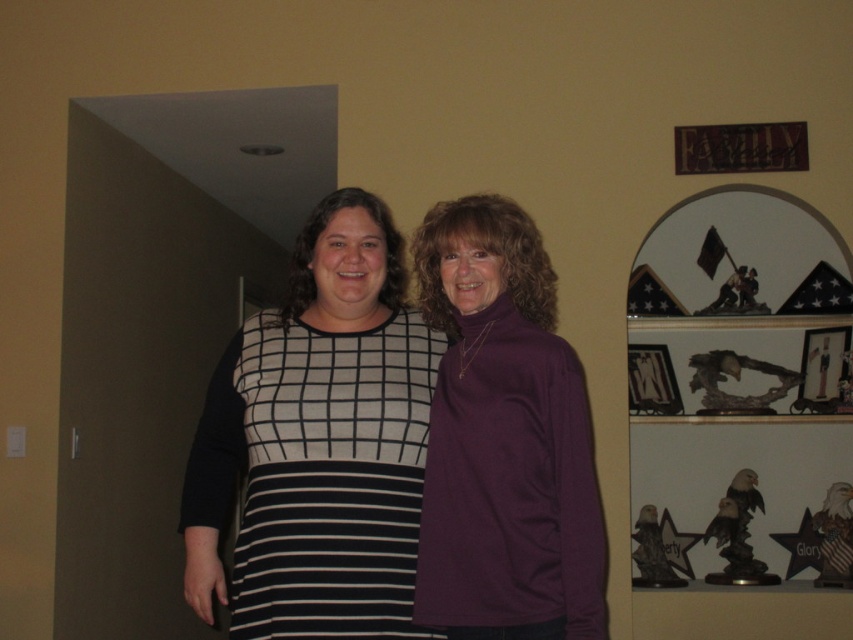
Does purple matte turtleneck sweater at right lie in front of black and white striped dress at center?

That is True.

Which is in front, point (576, 451) or point (256, 508)?

Point (576, 451) is more forward.

Which is in front, point (454, 212) or point (360, 524)?

Point (360, 524)

This screenshot has height=640, width=853. Find the location of `purple matte turtleneck sweater at right`. purple matte turtleneck sweater at right is located at coordinates (503, 438).

Who is more forward, (363, 392) or (828, 342)?

Point (363, 392)

Can you confirm if black and white striped dress at center is smaller than matte wooden picture frame at upper right?

No.

Which is behind, point (259, 618) or point (813, 340)?

Positioned behind is point (813, 340).

The height and width of the screenshot is (640, 853). I want to click on black and white striped dress at center, so click(329, 476).

Between purple matte turtleneck sweater at right and matte wooden picture frame at upper right, which one appears on the left side from the viewer's perspective?

Positioned to the left is purple matte turtleneck sweater at right.

Is purple matte turtleneck sweater at right shorter than matte wooden picture frame at upper right?

Incorrect, purple matte turtleneck sweater at right's height does not fall short of matte wooden picture frame at upper right's.

Which is in front, point (450, 467) or point (846, 344)?

Point (450, 467) is in front.

This screenshot has height=640, width=853. I want to click on purple matte turtleneck sweater at right, so [x=503, y=438].